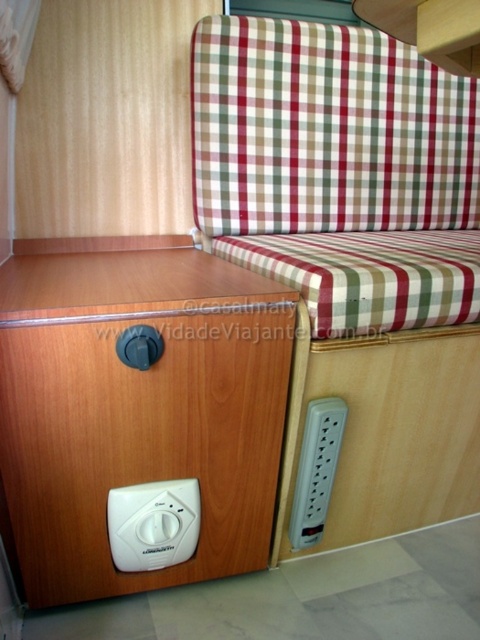
You are standing in the camper van and want to reach a specific point to plug in a device. The point is located at coordinates point (x=278, y=81). Considering the space described, is this point within your immediate reach without needing to move furniture?

The distance of point (x=278, y=81) from camera is 5.17 feet. Since 5.17 feet is approximately 62 inches, which is beyond typical arm reach, you would need to move closer or adjust your position to reach it.

You are organizing a small camping trip and need to know where to place your sleeping bag. According to the image, is the checkered fabric couch at upper right located above or below the white matte drawer at lower left?

The checkered fabric couch at upper right is above the white matte drawer at lower left.